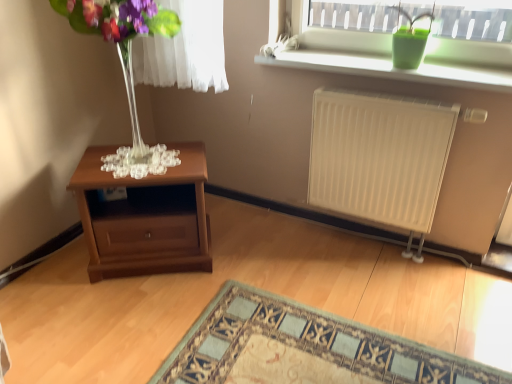
Image resolution: width=512 pixels, height=384 pixels. I want to click on free space in front of mahogany wood nightstand at lower left, so click(140, 317).